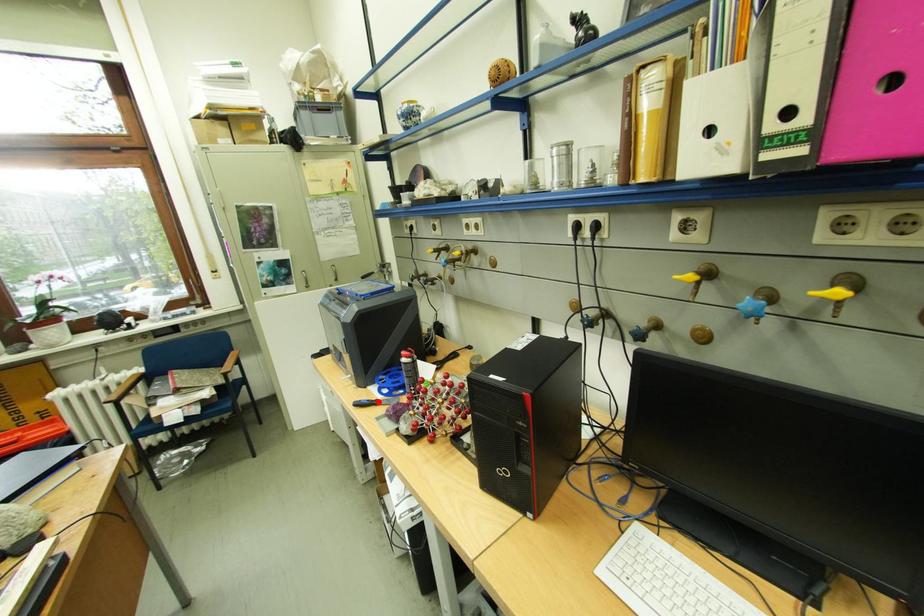
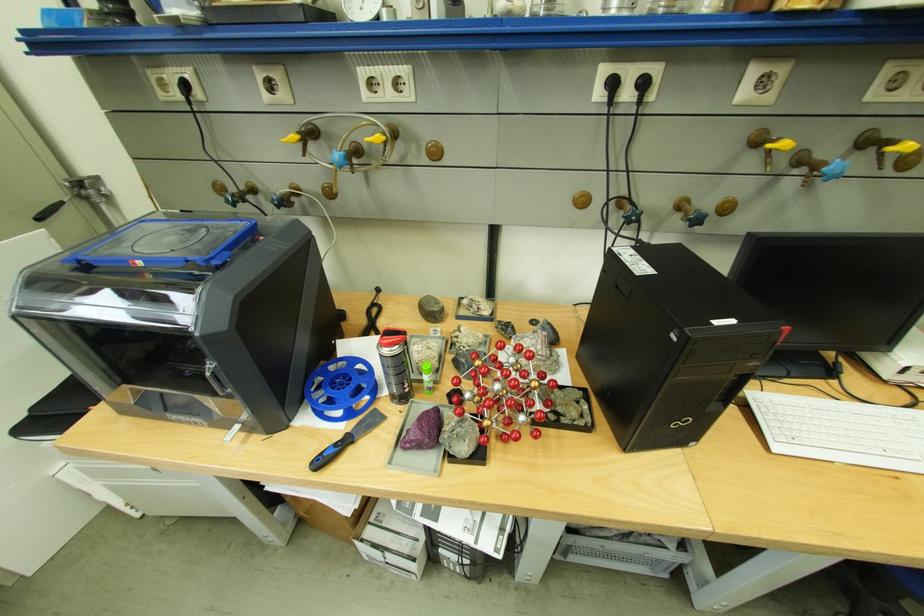
Where in the second image is the point corresponding to the highlighted location from the first image?

(346, 446)